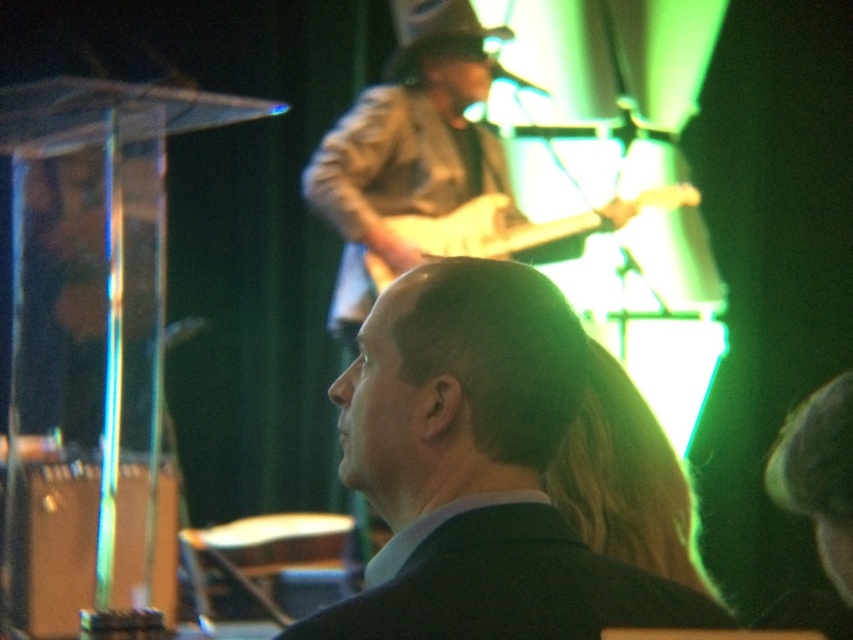
Question: Which point appears farthest from the camera in this image?

Choices:
 (A) (294, 630)
 (B) (360, 636)
 (C) (683, 192)

Answer: (C)

Question: Which of these objects is positioned farthest from the light brown wood guitar at center?

Choices:
 (A) black matte suit at center
 (B) black suit at center

Answer: (A)

Question: Is black suit at center in front of black matte suit at center?

Choices:
 (A) yes
 (B) no

Answer: (A)

Question: Can you confirm if black matte suit at center is thinner than light brown wood guitar at center?

Choices:
 (A) yes
 (B) no

Answer: (A)

Question: Among these objects, which one is nearest to the camera?

Choices:
 (A) black matte suit at center
 (B) light brown wood guitar at center

Answer: (A)

Question: Can you confirm if black suit at center is smaller than black matte suit at center?

Choices:
 (A) yes
 (B) no

Answer: (B)